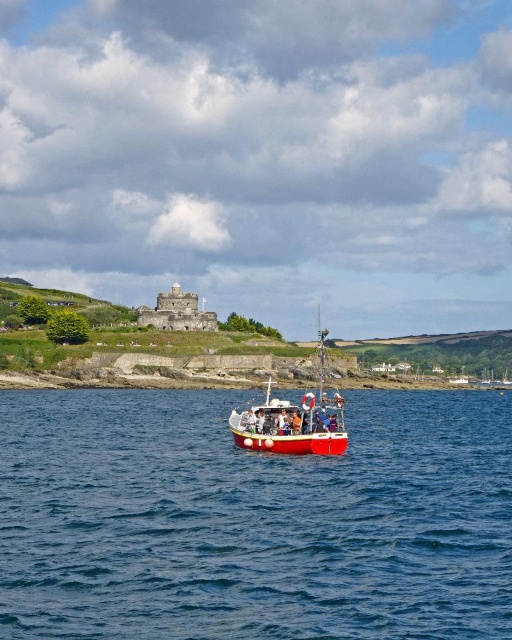
Who is shorter, blue water at center or red matte boat at center?

With less height is red matte boat at center.

Can you confirm if blue water at center is taller than red matte boat at center?

Correct, blue water at center is much taller as red matte boat at center.

Describe the element at coordinates (252, 520) in the screenshot. This screenshot has width=512, height=640. I see `blue water at center` at that location.

Identify the location of blue water at center. This screenshot has width=512, height=640. (252, 520).